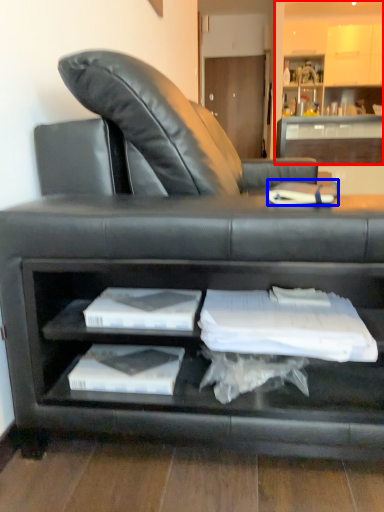
Question: Which object appears closest to the camera in this image, entertainment center (highlighted by a red box) or book (highlighted by a blue box)?

Choices:
 (A) entertainment center
 (B) book

Answer: (B)